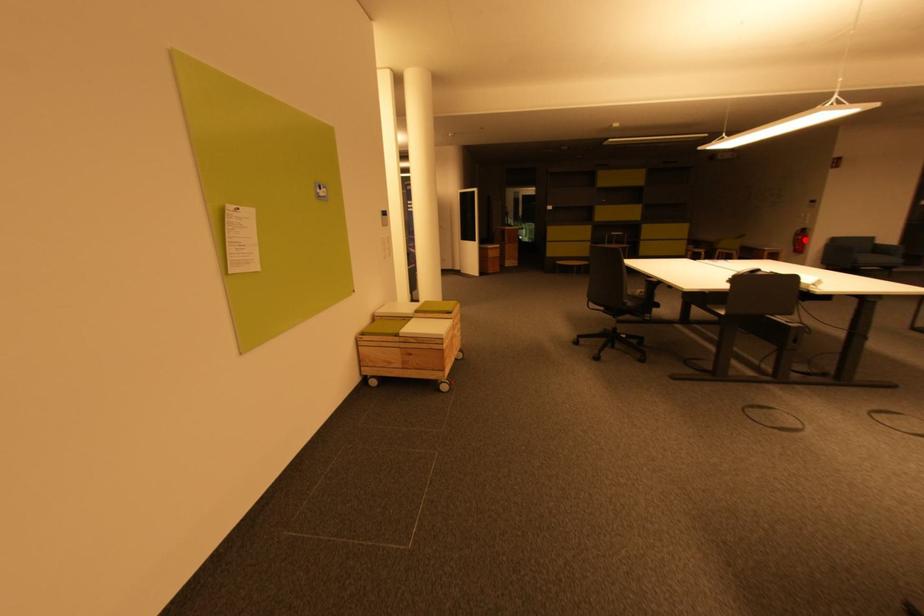
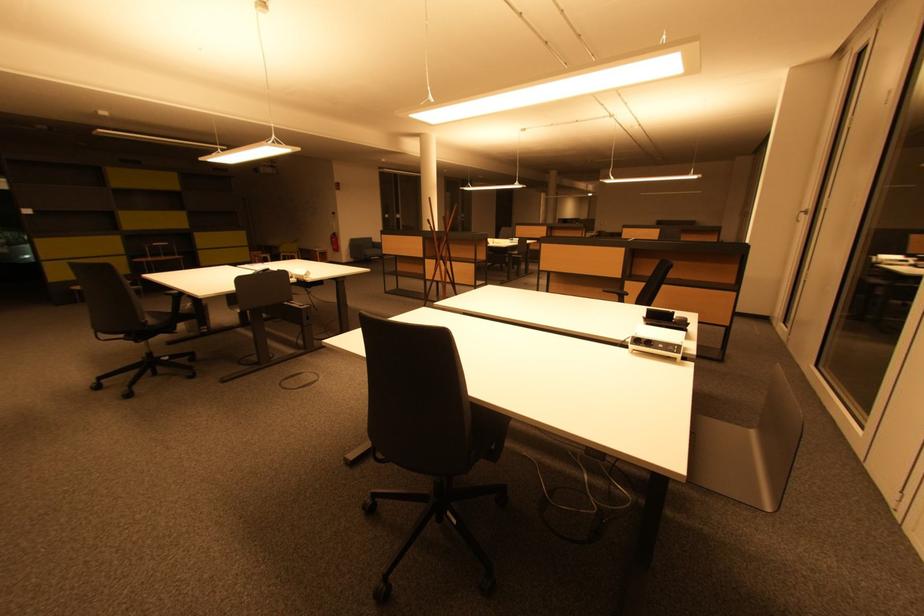
Locate, in the second image, the point that corresponds to the highlighted location in the first image.

(338, 241)